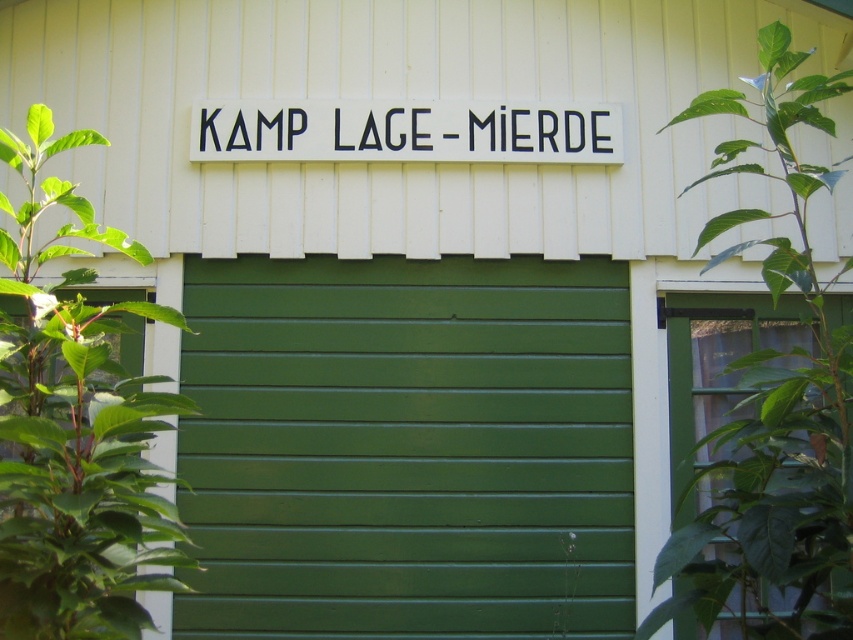
Question: Which point appears closest to the camera in this image?

Choices:
 (A) (491, 148)
 (B) (53, 529)

Answer: (B)

Question: From the image, what is the correct spatial relationship of green leafy plant at upper right in relation to black plastic sign at upper center?

Choices:
 (A) above
 (B) below

Answer: (B)

Question: Is green leafy plant at upper right to the right of black plastic sign at upper center from the viewer's perspective?

Choices:
 (A) yes
 (B) no

Answer: (A)

Question: Estimate the real-world distances between objects in this image. Which object is closer to the green painted metal/glass garage door at center?

Choices:
 (A) green leafy plant at upper right
 (B) green leafy plant at left

Answer: (A)

Question: Which point is closer to the camera?

Choices:
 (A) (759, 35)
 (B) (22, 612)

Answer: (B)

Question: Is green leafy plant at left smaller than green leafy plant at upper right?

Choices:
 (A) yes
 (B) no

Answer: (A)